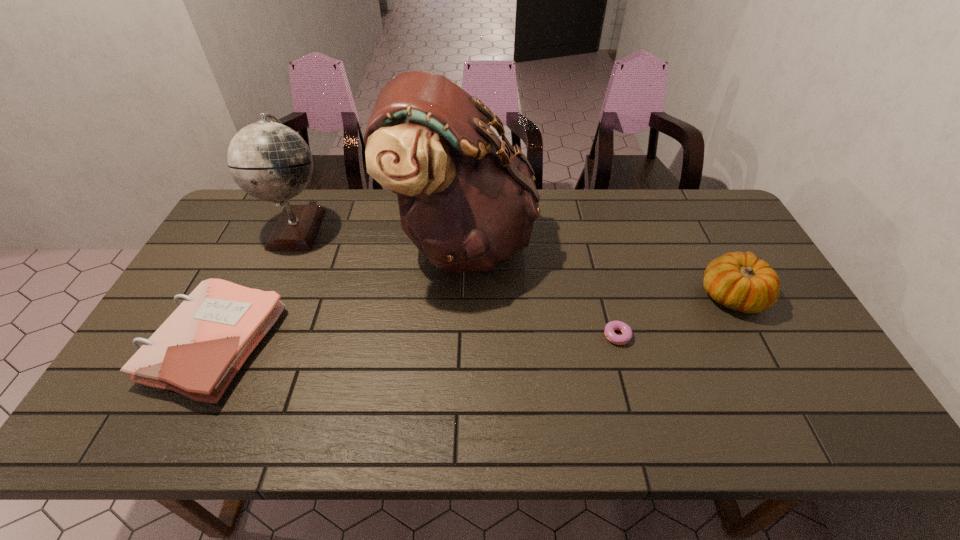
Where is `object that is positioned at the near left corner`? This screenshot has height=540, width=960. object that is positioned at the near left corner is located at coordinates (198, 350).

Locate an element on the screen. The image size is (960, 540). blank area at the far edge is located at coordinates (554, 193).

Identify the location of vacant region at the near edge of the desktop. The width and height of the screenshot is (960, 540). (474, 418).

In the image, there is a desktop. Where is `vacant space at the left edge`? vacant space at the left edge is located at coordinates (237, 265).

At what (x,y) coordinates should I click in order to perform the action: click on free spot at the right edge of the desktop. Please return your answer as a coordinate pair (x, y). The height and width of the screenshot is (540, 960). Looking at the image, I should click on (783, 312).

Identify the location of free region at the far left corner of the desktop. (x=252, y=230).

You are a GUI agent. You are given a task and a screenshot of the screen. Output one action in this format:
    pyautogui.click(x=<x>, y=<y>)
    Task: Click on the empty space between the gourd and the fourth tallest object
    
    Given the screenshot: What is the action you would take?
    pyautogui.click(x=472, y=320)

Locate an element on the screen. This screenshot has height=540, width=960. free space between the fourth shortest object and the fourth object from left to right is located at coordinates (458, 281).

This screenshot has height=540, width=960. I want to click on vacant area between the second shortest object and the third shortest object, so click(x=472, y=320).

Locate an element on the screen. blank region between the second object from right to left and the rightmost object is located at coordinates (676, 316).